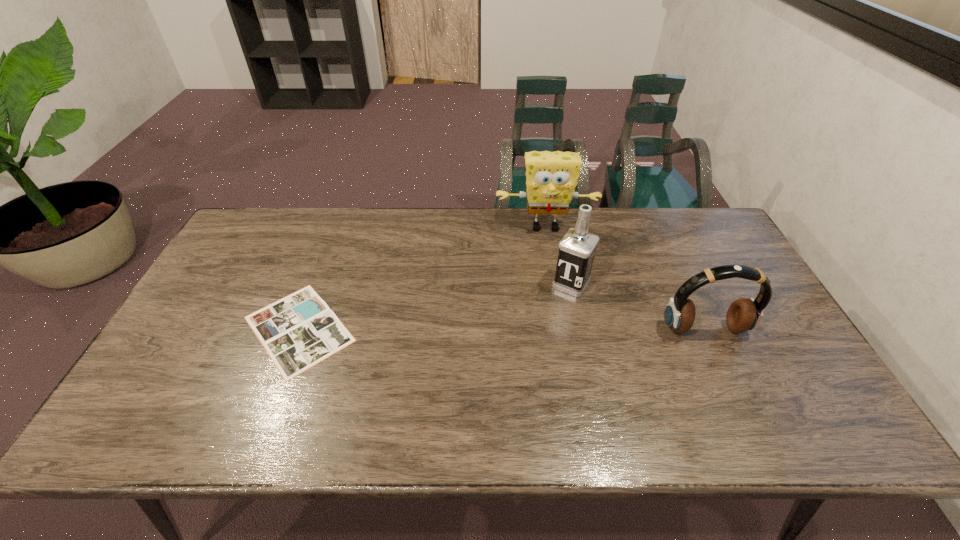
Where is `vacant region located 0.120m on the face of the farthest object`? Image resolution: width=960 pixels, height=540 pixels. vacant region located 0.120m on the face of the farthest object is located at coordinates (549, 263).

You are a GUI agent. You are given a task and a screenshot of the screen. Output one action in this format:
    pyautogui.click(x=<x>, y=<y>)
    Task: Click on the vacant region located 0.330m on the front label of the vodka
    The height and width of the screenshot is (540, 960).
    Given the screenshot: What is the action you would take?
    (510, 380)

Find the location of `free space located on the front label of the vodka`. free space located on the front label of the vodka is located at coordinates tap(552, 314).

This screenshot has height=540, width=960. Identify the location of blank space located on the front label of the vodka. (552, 314).

The height and width of the screenshot is (540, 960). In order to click on object at the far edge in this screenshot , I will do `click(551, 177)`.

At what (x,y) coordinates should I click in order to perform the action: click on object at the near edge. Please return your answer as a coordinate pair (x, y). Looking at the image, I should click on [x=298, y=331].

I want to click on object present at the right edge, so click(x=744, y=314).

Locate an element on the screen. This screenshot has height=540, width=960. vacant area at the far edge is located at coordinates 623,247.

The width and height of the screenshot is (960, 540). I want to click on free space at the near edge, so click(234, 380).

At what (x,y) coordinates should I click in order to perform the action: click on free region at the left edge of the desktop. Please return your answer as a coordinate pair (x, y). This screenshot has height=540, width=960. Looking at the image, I should click on (203, 334).